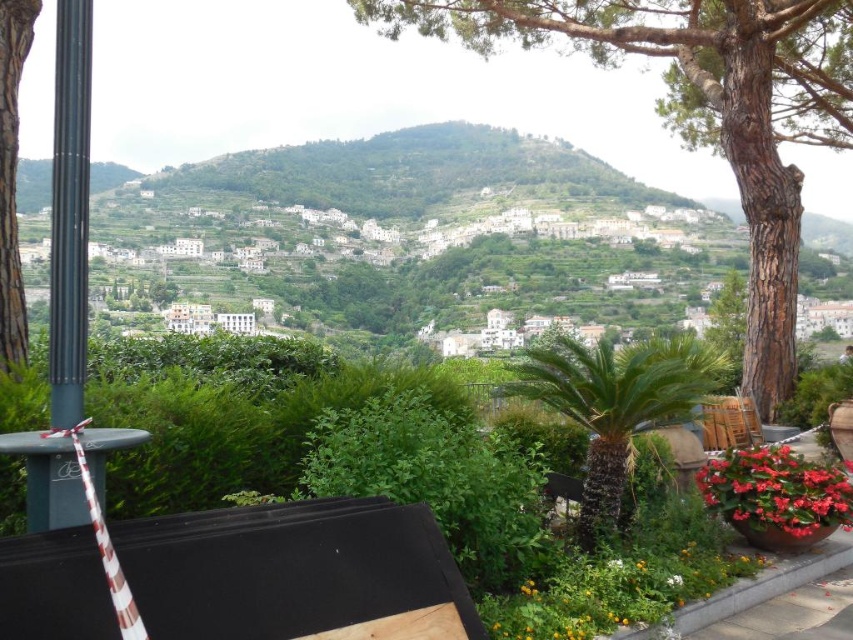
Question: Which of the following is the farthest from the observer?

Choices:
 (A) (500, 32)
 (B) (601, 456)
 (C) (277, 225)
 (D) (804, 532)

Answer: (C)

Question: Considering the relative positions of brown rough bark tree at upper center and vivid red petals at lower right in the image provided, where is brown rough bark tree at upper center located with respect to vivid red petals at lower right?

Choices:
 (A) below
 (B) above

Answer: (B)

Question: Is green leafy hillside at center in front of green leafy palm at center?

Choices:
 (A) no
 (B) yes

Answer: (B)

Question: Based on their relative distances, which object is farther from the vivid red petals at lower right?

Choices:
 (A) green leafy hillside at center
 (B) brown rough bark tree at left
 (C) green leafy palm at center
 (D) brown rough bark tree at upper center

Answer: (A)

Question: Does green leafy hillside at center appear on the left side of vivid red petals at lower right?

Choices:
 (A) no
 (B) yes

Answer: (B)

Question: Which point is farther to the camera?

Choices:
 (A) (706, 45)
 (B) (740, 508)
 (C) (4, 278)
 (D) (219, 253)

Answer: (D)